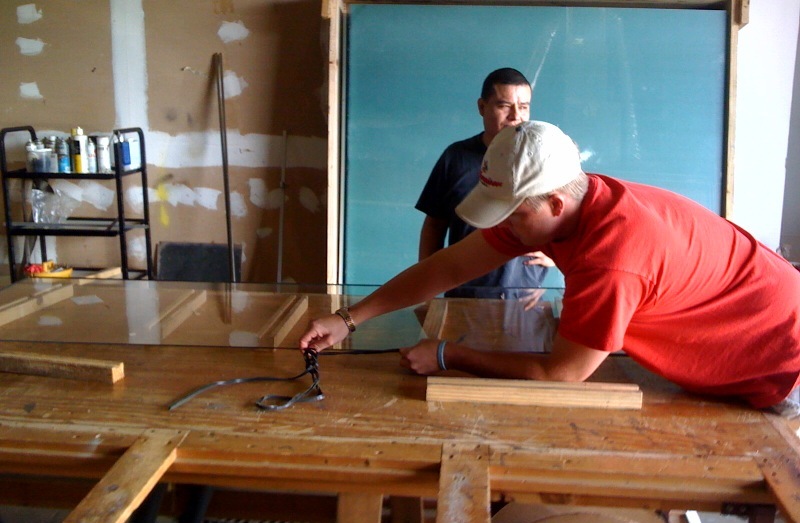
Find the location of a particular element. bottles of product is located at coordinates (130, 158), (106, 155), (90, 155), (74, 155), (56, 155), (46, 155).